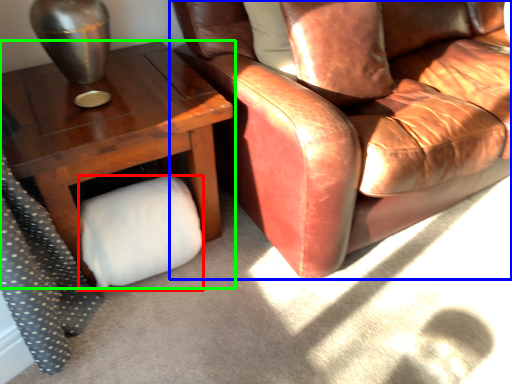
Question: Which object is positioned farthest from toilet paper (highlighted by a red box)? Select from chair (highlighted by a blue box) and table (highlighted by a green box).

Choices:
 (A) chair
 (B) table

Answer: (A)